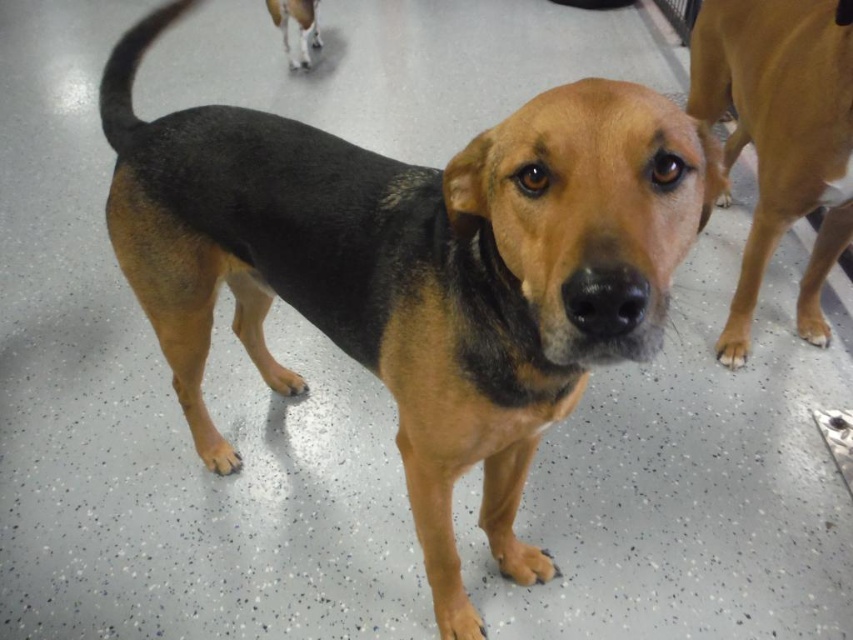
You are a veterinarian assessing the space requirements for two dogs in a kennel. You see the brown fur dog at center and the brown matte fur at right. Which dog requires a larger enclosure based on their width?

The brown fur dog at center might be wider than brown matte fur at right, so it likely requires a larger enclosure to accommodate its width.

You are a photographer trying to capture a group photo of the dogs in the shelter. The main dog, represented by the point [415,269], is at the center. Where should you position your camera to ensure the main dog is centered in the photo?

The main dog is already at the center, represented by point [415,269], so positioning the camera directly facing the center of the scene will keep it centered in the photo.

You are a photographer setting up a shoot in a dog shelter. You need to place a small prop between the brown matte fur at right and the white fur at upper center of the dog. Given their sizes, which area should the prop be placed closer to?

The prop should be placed closer to the white fur at upper center because the brown matte fur at right is larger in size, so positioning the prop near the smaller area ensures balance and visibility.